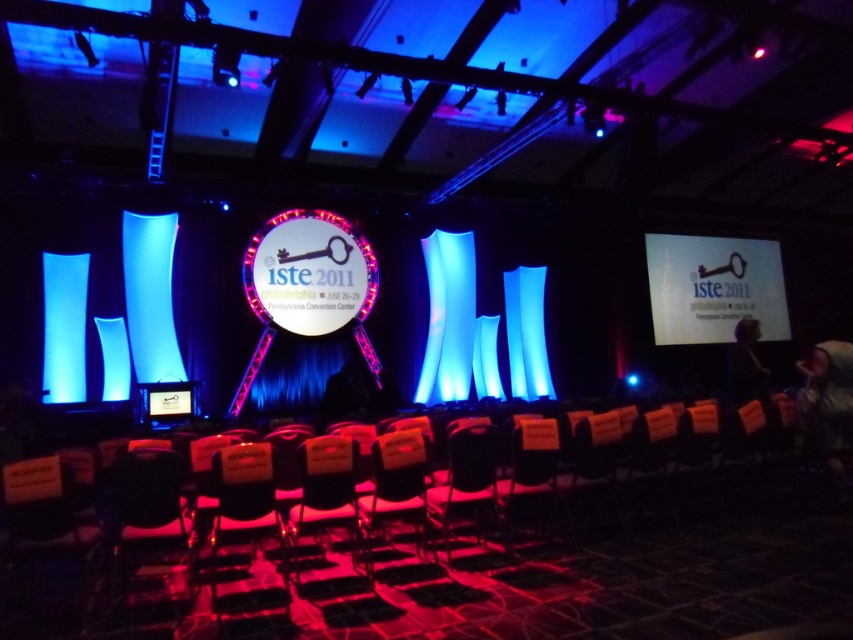
Question: Which point is closer to the camera?

Choices:
 (A) white matte projection screen at upper center
 (B) black plastic chair at center
 (C) orange fabric chair at center

Answer: (C)

Question: Which point is closer to the camera?

Choices:
 (A) orange fabric chair at center
 (B) black plastic chair at center
 (C) white matte projection screen at upper center

Answer: (A)

Question: Does white matte projection screen at upper center appear on the right side of black plastic chair at center?

Choices:
 (A) yes
 (B) no

Answer: (A)

Question: Observing the image, what is the correct spatial positioning of white matte projection screen at upper center in reference to orange fabric chair at center?

Choices:
 (A) left
 (B) right

Answer: (B)

Question: Is white matte projection screen at upper center above black plastic chair at center?

Choices:
 (A) yes
 (B) no

Answer: (A)

Question: Among these objects, which one is nearest to the camera?

Choices:
 (A) black plastic chair at center
 (B) orange fabric chair at center
 (C) white matte projection screen at upper center

Answer: (B)